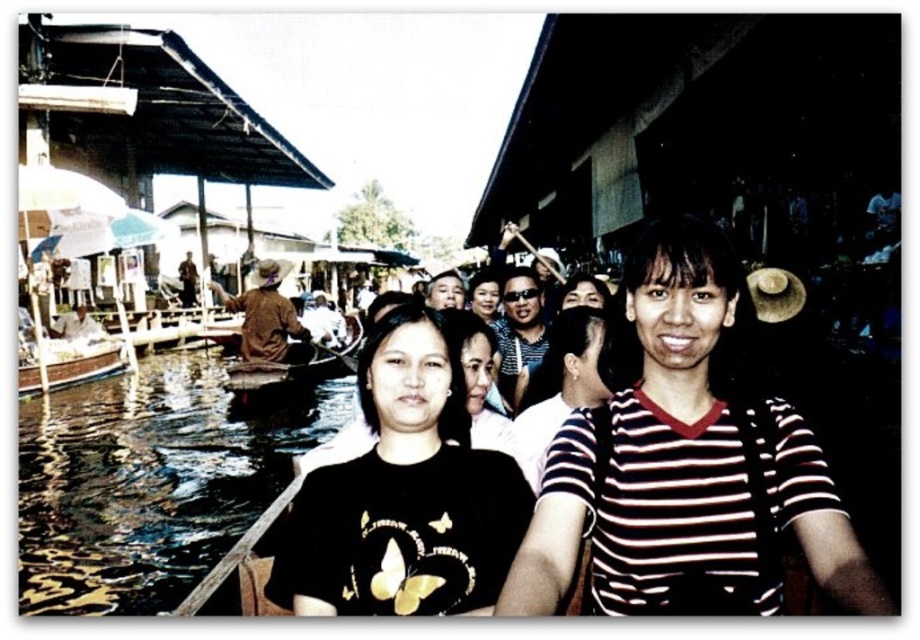
You are a photographer standing at the edge of the floating market. You want to capture a photo of the black matte shirt at center and the brown leather hat at upper center in the same frame. Given that your camera has a maximum zoom range of 100 feet, can you fit both objects in the frame without moving closer?

The black matte shirt at center and brown leather hat at upper center are 118.15 feet apart, which exceeds the camera maximum zoom range of 100 feet. Therefore, you cannot fit both objects in the frame without moving closer.